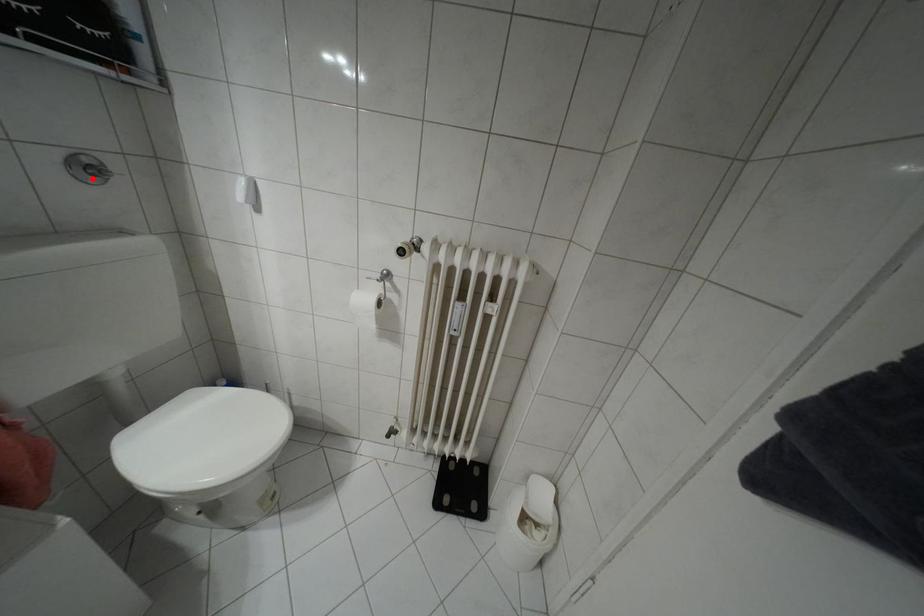
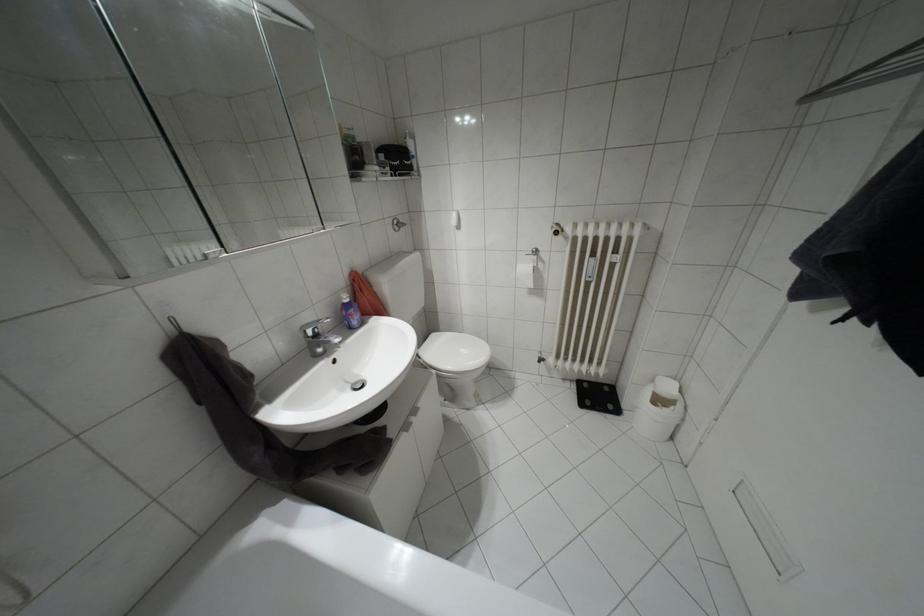
Question: I am providing you with two images of the same scene from different viewpoints. A red point is marked on the first image. At the location where the point appears in image 1, is it still visible in image 2?

Choices:
 (A) Yes
 (B) No

Answer: (A)